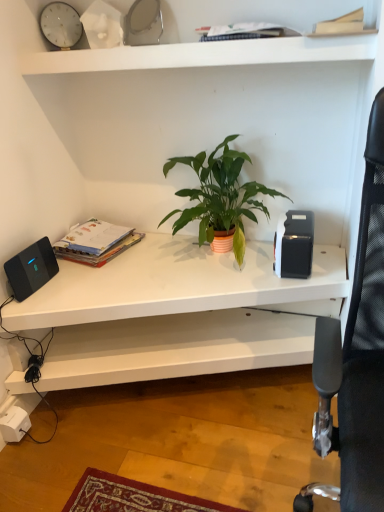
Question: Is matte paperbacks at left, which is counted as the first paperback book, starting from the back, positioned with its back to light brown paper at upper right, the 1th paperback book in the right-to-left sequence?

Choices:
 (A) no
 (B) yes

Answer: (A)

Question: Is matte paperbacks at left, which is the 1th paperback book from left to right, taller than light brown paper at upper right, the first paperback book from the top?

Choices:
 (A) no
 (B) yes

Answer: (B)

Question: Does matte paperbacks at left, arranged as the second paperback book when viewed from the front, have a smaller size compared to light brown paper at upper right, placed as the second paperback book when sorted from bottom to top?

Choices:
 (A) no
 (B) yes

Answer: (A)

Question: From a real-world perspective, is matte paperbacks at left, arranged as the second paperback book when viewed from the front, on light brown paper at upper right, the 1th paperback book in the right-to-left sequence?

Choices:
 (A) no
 (B) yes

Answer: (A)

Question: Can you confirm if matte paperbacks at left, acting as the 2th paperback book starting from the top, is bigger than light brown paper at upper right, which ranks as the second paperback book in back-to-front order?

Choices:
 (A) no
 (B) yes

Answer: (B)

Question: From a real-world perspective, is matte paperbacks at left, which is counted as the first paperback book, starting from the back, below light brown paper at upper right, the 1th paperback book in the right-to-left sequence?

Choices:
 (A) no
 (B) yes

Answer: (B)

Question: Is black matte speaker at left positioned before black plastic toaster at right?

Choices:
 (A) yes
 (B) no

Answer: (A)

Question: Would you consider black matte speaker at left to be distant from black plastic toaster at right?

Choices:
 (A) yes
 (B) no

Answer: (B)

Question: Is black matte speaker at left smaller than black plastic toaster at right?

Choices:
 (A) no
 (B) yes

Answer: (B)

Question: Can you confirm if black matte speaker at left is bigger than black plastic toaster at right?

Choices:
 (A) yes
 (B) no

Answer: (B)

Question: Does black matte speaker at left have a lesser width compared to black plastic toaster at right?

Choices:
 (A) yes
 (B) no

Answer: (A)

Question: Can you confirm if black matte speaker at left is positioned to the left of black plastic toaster at right?

Choices:
 (A) no
 (B) yes

Answer: (B)

Question: Is black plastic toaster at right not inside white matte shelf at upper center, positioned as the first shelf in top-to-bottom order?

Choices:
 (A) no
 (B) yes

Answer: (B)